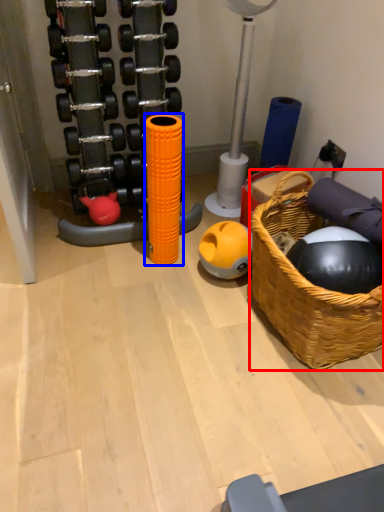
Question: Which of the following is the closest to the observer, basket (highlighted by a red box) or toy (highlighted by a blue box)?

Choices:
 (A) basket
 (B) toy

Answer: (A)